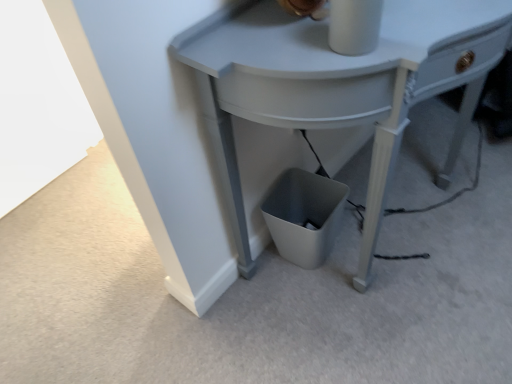
At what (x,y) coordinates should I click in order to perform the action: click on free space below matte white table at center (from a real-world perspective). Please return your answer as a coordinate pair (x, y). Looking at the image, I should click on (394, 217).